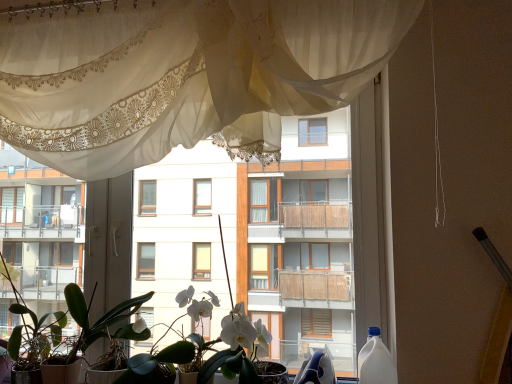
What do you see at coordinates (41, 228) in the screenshot? I see `white glossy balcony at left` at bounding box center [41, 228].

Find the location of a particular element. This screenshot has width=512, height=384. sheer white curtain at upper center is located at coordinates (183, 75).

What do you see at coordinates (376, 361) in the screenshot? The image size is (512, 384). I see `white plastic bottle at right` at bounding box center [376, 361].

Locate an element on the screen. The width and height of the screenshot is (512, 384). white matte orchid at center is located at coordinates (204, 346).

Does white glossy balcony at left have a greater width compared to sheer white curtain at upper center?

Yes.

In the image, is white glossy balcony at left on the left side or the right side of sheer white curtain at upper center?

Clearly, white glossy balcony at left is on the left of sheer white curtain at upper center in the image.

From the image's perspective, which object appears higher, white glossy balcony at left or sheer white curtain at upper center?

sheer white curtain at upper center is shown above in the image.

Is white glossy balcony at left in contact with sheer white curtain at upper center?

They are not placed beside each other.

Is point (385, 365) closer to camera compared to point (9, 352)?

Yes, it is.

Measure the distance between white plastic bottle at right and green matte plant at lower left.

The distance of white plastic bottle at right from green matte plant at lower left is 1.06 meters.

Is white plastic bottle at right not inside green matte plant at lower left?

white plastic bottle at right is positioned outside green matte plant at lower left.

Is white plastic bottle at right next to green matte plant at lower left and touching it?

No, white plastic bottle at right is not in contact with green matte plant at lower left.

From a real-world perspective, is white glossy balcony at left above or below green matte plant at lower left?

In terms of real-world spatial position, white glossy balcony at left is above green matte plant at lower left.

Is white glossy balcony at left not inside green matte plant at lower left?

white glossy balcony at left lies outside green matte plant at lower left's area.

Who is bigger, white glossy balcony at left or green matte plant at lower left?

With larger size is white glossy balcony at left.

The image size is (512, 384). What are the coordinates of `condominium that appears above the green matte plant at lower left (from a real-world perspective)` in the screenshot? It's located at (41, 228).

Is green matte plant at lower left aimed at white glossy balcony at left?

No, green matte plant at lower left does not turn towards white glossy balcony at left.

From the image's perspective, is green matte plant at lower left below white glossy balcony at left?

Yes, from the image's perspective, green matte plant at lower left is below white glossy balcony at left.

Is there a large distance between green matte plant at lower left and white glossy balcony at left?

Actually, green matte plant at lower left and white glossy balcony at left are a little close together.

Where is `condominium above the green matte plant at lower left (from the image's perspective)`? condominium above the green matte plant at lower left (from the image's perspective) is located at coordinates (41, 228).

Is white glossy balcony at left closer to the viewer compared to white plastic bottle at right?

No, the depth of white glossy balcony at left is greater than that of white plastic bottle at right.

Is white glossy balcony at left located outside white plastic bottle at right?

Yes, white glossy balcony at left is not within white plastic bottle at right.

Identify the location of bottle lying below the white glossy balcony at left (from the image's perspective). The width and height of the screenshot is (512, 384). (376, 361).

Can you confirm if green matte plant at lower left is taller than white plastic bottle at right?

Indeed, green matte plant at lower left has a greater height compared to white plastic bottle at right.

Identify the location of houseplant lying behind the white plastic bottle at right. (74, 320).

Measure the distance from green matte plant at lower left to white plastic bottle at right.

A distance of 1.06 meters exists between green matte plant at lower left and white plastic bottle at right.

Is green matte plant at lower left aimed at white plastic bottle at right?

No, green matte plant at lower left does not turn towards white plastic bottle at right.

From the picture: Would you say green matte plant at lower left is inside or outside white matte orchid at center?

green matte plant at lower left is not enclosed by white matte orchid at center.

From a real-world perspective, is green matte plant at lower left physically below white matte orchid at center?

Yes, from a real-world perspective, green matte plant at lower left is under white matte orchid at center.

You are a GUI agent. You are given a task and a screenshot of the screen. Output one action in this format:
    pyautogui.click(x=<x>, y=<y>)
    Task: Click on the houseplant behind the white matte orchid at center
    
    Given the screenshot: What is the action you would take?
    pyautogui.click(x=74, y=320)

Considering the points (106, 315) and (190, 285), which point is in front, point (106, 315) or point (190, 285)?

Positioned in front is point (190, 285).

What are the coordinates of `curtain on the right of the white glossy balcony at left` in the screenshot? It's located at (x=183, y=75).

Find the location of a particular element. This screenshot has height=384, width=512. bottle lying in front of the green matte plant at lower left is located at coordinates (376, 361).

Considering their positions, is white glossy balcony at left positioned further to green matte plant at lower left than white plastic bottle at right?

The object further to green matte plant at lower left is white plastic bottle at right.

From the image, which object appears to be nearer to white plastic bottle at right, sheer white curtain at upper center or white glossy balcony at left?

sheer white curtain at upper center is positioned closer to the anchor white plastic bottle at right.

Considering their positions, is green matte plant at lower left positioned further to white matte orchid at center than white glossy balcony at left?

white glossy balcony at left lies further to white matte orchid at center than the other object.

Considering their positions, is white matte orchid at center positioned closer to green matte plant at lower left than white plastic bottle at right?

white matte orchid at center is closer to green matte plant at lower left.

Considering their positions, is white matte orchid at center positioned closer to white plastic bottle at right than green matte plant at lower left?

The object closer to white plastic bottle at right is white matte orchid at center.

From the picture: Based on their spatial positions, is white glossy balcony at left or white matte orchid at center closer to sheer white curtain at upper center?

white glossy balcony at left is closer to sheer white curtain at upper center.

From the image, which object appears to be nearer to white matte orchid at center, green matte plant at lower left or white plastic bottle at right?

green matte plant at lower left lies closer to white matte orchid at center than the other object.

Looking at the image, which one is located closer to white plastic bottle at right, white matte orchid at center or white glossy balcony at left?

Among the two, white matte orchid at center is located nearer to white plastic bottle at right.

Where is `houseplant located between white glossy balcony at left and white plastic bottle at right in the left-right direction`? houseplant located between white glossy balcony at left and white plastic bottle at right in the left-right direction is located at coordinates (74, 320).

Where is `floral arrangement between sheer white curtain at upper center and white plastic bottle at right vertically`? This screenshot has height=384, width=512. floral arrangement between sheer white curtain at upper center and white plastic bottle at right vertically is located at coordinates (204, 346).

The width and height of the screenshot is (512, 384). What are the coordinates of `houseplant between white glossy balcony at left and white matte orchid at center from left to right` in the screenshot? It's located at (74, 320).

This screenshot has width=512, height=384. Find the location of `houseplant between sheer white curtain at upper center and white plastic bottle at right vertically`. houseplant between sheer white curtain at upper center and white plastic bottle at right vertically is located at coordinates (74, 320).